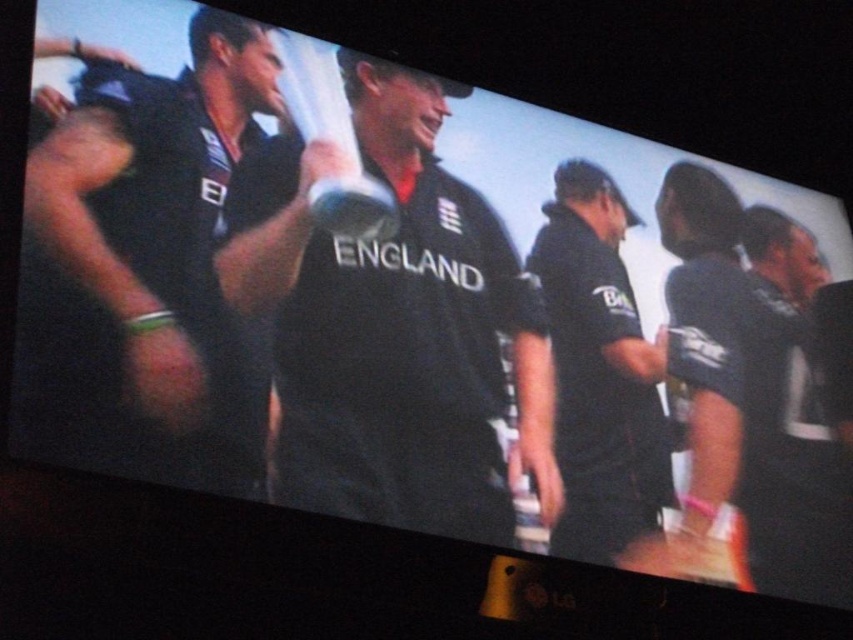
Does black matte shirt at center come behind black matte shirt at right?

No, it is in front of black matte shirt at right.

Which is above, black matte shirt at center or black matte shirt at right?

black matte shirt at center is above.

Is point (271, 161) closer to viewer compared to point (630, 394)?

Yes, point (271, 161) is in front of point (630, 394).

Find the location of `black matte shirt at center`. black matte shirt at center is located at coordinates (392, 326).

Does black matte shirt at center appear on the left side of matte black shirt at left?

Incorrect, black matte shirt at center is not on the left side of matte black shirt at left.

Is black matte shirt at center to the right of matte black shirt at left from the viewer's perspective?

Correct, you'll find black matte shirt at center to the right of matte black shirt at left.

Where is `black matte shirt at center`? black matte shirt at center is located at coordinates (392, 326).

Is matte black shirt at left taller than black matte shirt at right?

Yes, matte black shirt at left is taller than black matte shirt at right.

Is matte black shirt at left wider than black matte shirt at right?

Indeed, matte black shirt at left has a greater width compared to black matte shirt at right.

Locate an element on the screen. matte black shirt at left is located at coordinates (143, 269).